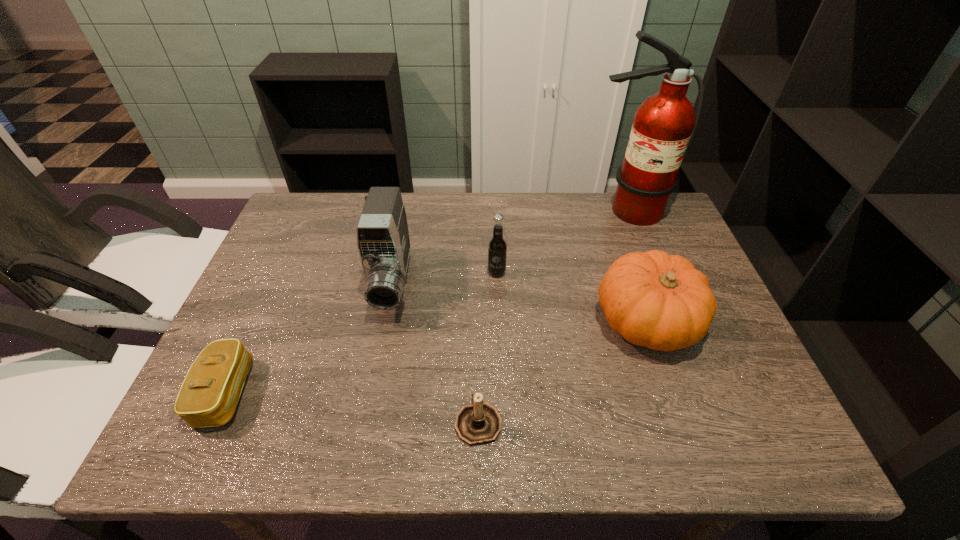
This screenshot has width=960, height=540. What are the coordinates of `free location located 0.150m at the front of the camcorder, highlighting the lens` in the screenshot? It's located at (373, 379).

Locate an element on the screen. The width and height of the screenshot is (960, 540). free space located 0.390m on the label of the root beer is located at coordinates (502, 415).

You are a GUI agent. You are given a task and a screenshot of the screen. Output one action in this format:
    pyautogui.click(x=<x>, y=<y>)
    Task: Click on the free point located on the back of the pumpkin
    
    Given the screenshot: What is the action you would take?
    pyautogui.click(x=619, y=243)

Where is `vacant space located 0.320m on the left of the candle holder`? vacant space located 0.320m on the left of the candle holder is located at coordinates (297, 421).

Locate an element on the screen. free space located 0.260m on the zipper side of the leftmost object is located at coordinates (372, 393).

Image resolution: width=960 pixels, height=540 pixels. What are the coordinates of `object located at the far edge` in the screenshot? It's located at [x=664, y=124].

Locate an element on the screen. This screenshot has height=540, width=960. candle holder that is at the near edge is located at coordinates (479, 423).

Locate an element on the screen. clutch bag situated at the near edge is located at coordinates (208, 397).

Where is `object positioned at the left edge`? Image resolution: width=960 pixels, height=540 pixels. object positioned at the left edge is located at coordinates (208, 397).

At what (x,y) coordinates should I click in order to perform the action: click on fire extinguisher that is at the right edge. Please return your answer as a coordinate pair (x, y). Image resolution: width=960 pixels, height=540 pixels. Looking at the image, I should click on point(664,124).